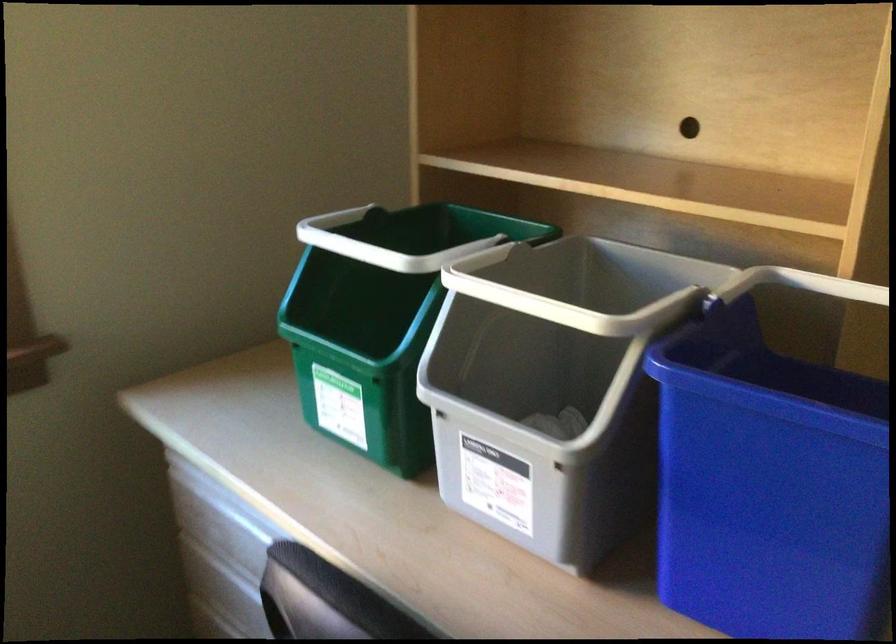
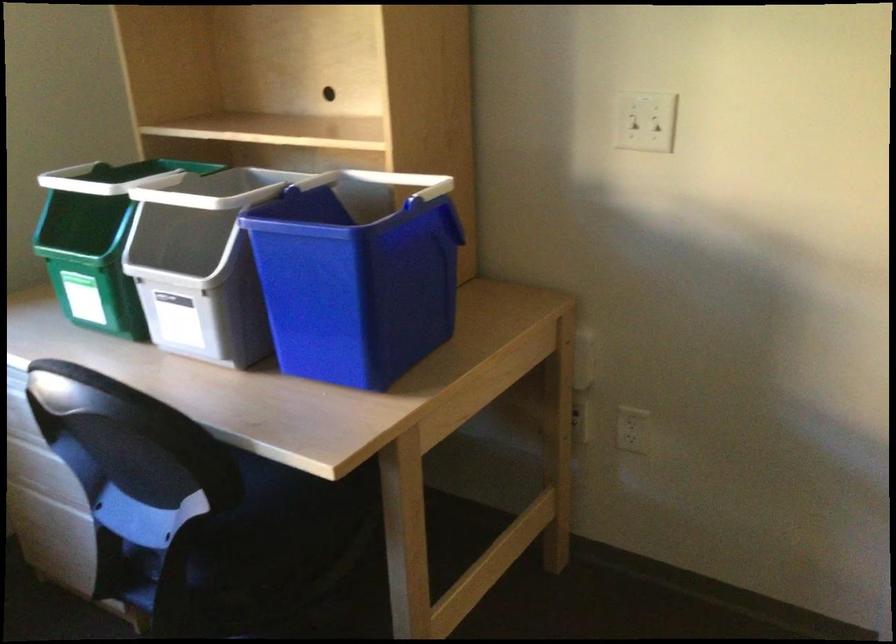
Find the pixel in the second image that matches pixel 391 230 in the first image.

(116, 178)